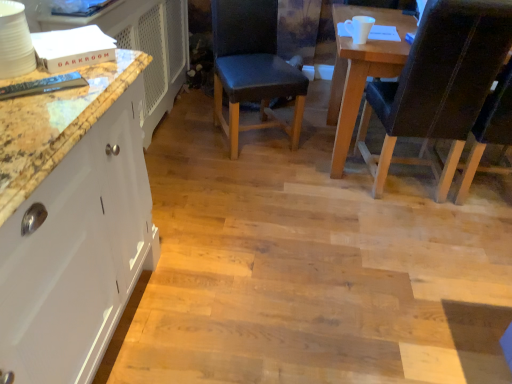
Where is `free space in front of dark blue leather chair at center, the second chair when ordered from right to left`? The image size is (512, 384). free space in front of dark blue leather chair at center, the second chair when ordered from right to left is located at coordinates (245, 173).